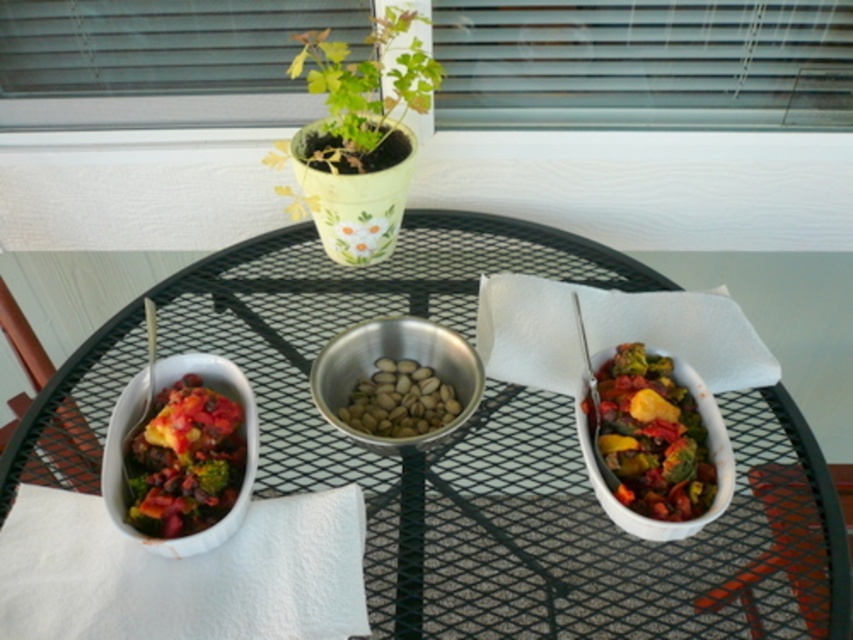
Question: Is green matte plant at upper center thinner than metallic silver bowl at center?

Choices:
 (A) yes
 (B) no

Answer: (B)

Question: Is green matte plant at upper center positioned in front of white matte bowl at right?

Choices:
 (A) yes
 (B) no

Answer: (B)

Question: Which of the following is the farthest from the observer?

Choices:
 (A) metallic mesh table at center
 (B) green matte plant at upper center
 (C) white matte bowl at right
 (D) matte ceramic bowl at left

Answer: (B)

Question: Can you confirm if metallic mesh table at center is positioned to the left of metallic silver bowl at center?

Choices:
 (A) yes
 (B) no

Answer: (B)

Question: Estimate the real-world distances between objects in this image. Which object is closer to the green matte plant at upper center?

Choices:
 (A) white matte bowl at right
 (B) metallic silver bowl at center
 (C) matte ceramic bowl at left

Answer: (B)

Question: Among these points, which one is nearest to the camera?

Choices:
 (A) (662, 529)
 (B) (120, 528)

Answer: (A)